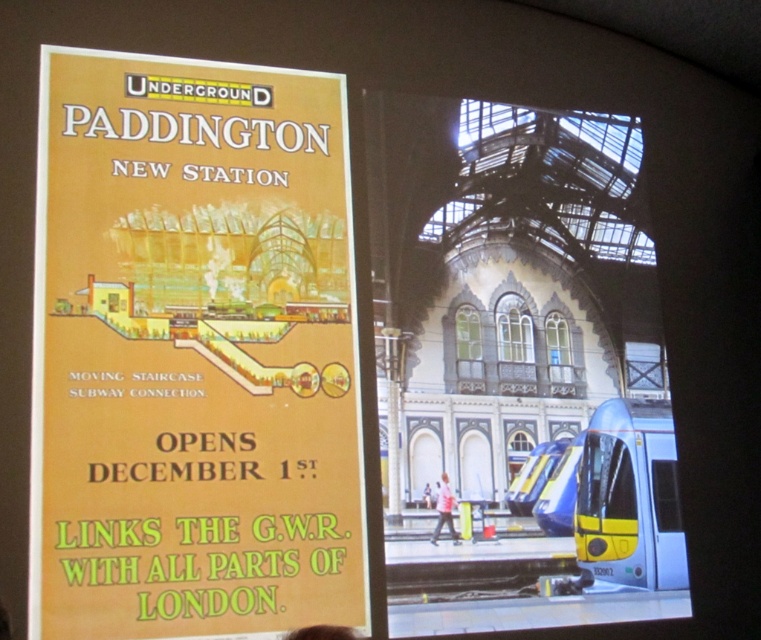
Question: Does blue/yellow metal train at center appear under white fabric at center?

Choices:
 (A) no
 (B) yes

Answer: (A)

Question: Which of the following is the closest to the observer?

Choices:
 (A) yellow and blue plastic train at lower right
 (B) white fabric at center

Answer: (B)

Question: Which point is closer to the camera taking this photo?

Choices:
 (A) (572, 589)
 (B) (314, 634)
 (C) (145, 296)

Answer: (B)

Question: Does matte yellow poster at upper left have a smaller size compared to yellow and blue plastic train at lower right?

Choices:
 (A) no
 (B) yes

Answer: (A)

Question: Does white fabric at center appear under brown hair at upper center?

Choices:
 (A) yes
 (B) no

Answer: (B)

Question: Which object is the farthest from the blue/yellow metal train at center?

Choices:
 (A) white fabric at center
 (B) matte yellow poster at upper left
 (C) yellow and blue plastic train at lower right

Answer: (B)